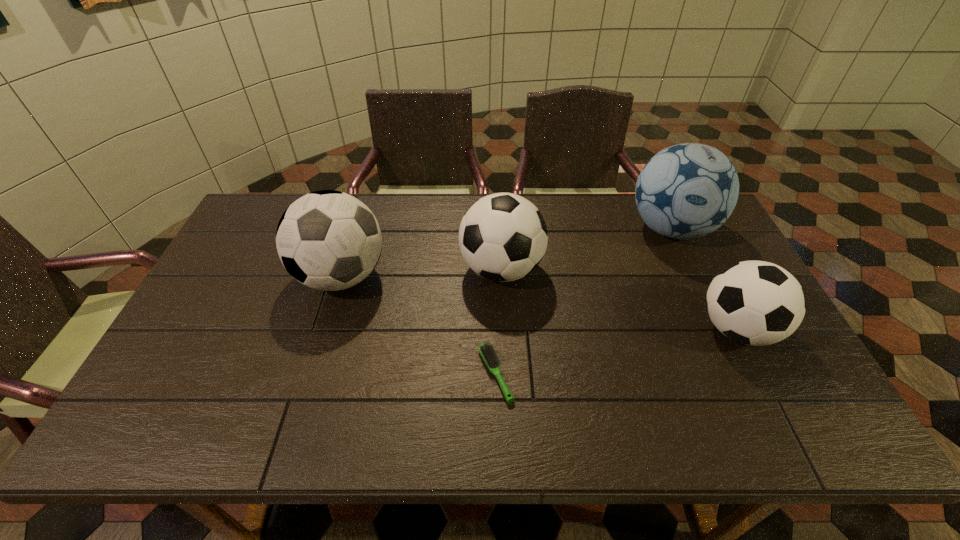
Find the location of `vacant region at the far edge`. vacant region at the far edge is located at coordinates (553, 212).

I want to click on vacant region at the near edge of the desktop, so click(323, 433).

Identify the location of vacant region at the far left corner of the desktop. (258, 210).

The height and width of the screenshot is (540, 960). Identify the location of free spot between the third soccer ball from right to left and the leftmost object. (421, 273).

At what (x,y) coordinates should I click in order to perform the action: click on empty space between the leftmost soccer ball and the third soccer ball from right to left. Please return your answer as a coordinate pair (x, y). Looking at the image, I should click on (421, 273).

At what (x,y) coordinates should I click in order to perform the action: click on unoccupied position between the third soccer ball from right to left and the hairbrush. Please return your answer as a coordinate pair (x, y). The width and height of the screenshot is (960, 540). Looking at the image, I should click on (498, 321).

The width and height of the screenshot is (960, 540). In order to click on free spot between the shortest soccer ball and the second soccer ball from left to right in this screenshot , I will do `click(619, 299)`.

Locate an element on the screen. free space between the second soccer ball from left to right and the fourth tallest object is located at coordinates (619, 299).

The height and width of the screenshot is (540, 960). I want to click on free space between the leftmost soccer ball and the third soccer ball from right to left, so click(x=421, y=273).

Identify which object is located as the second nearest to the third soccer ball from right to left. Please provide its 2D coordinates. Your answer should be formatted as a tuple, i.e. [(x, y)], where the tuple contains the x and y coordinates of a point satisfying the conditions above.

[(327, 240)]